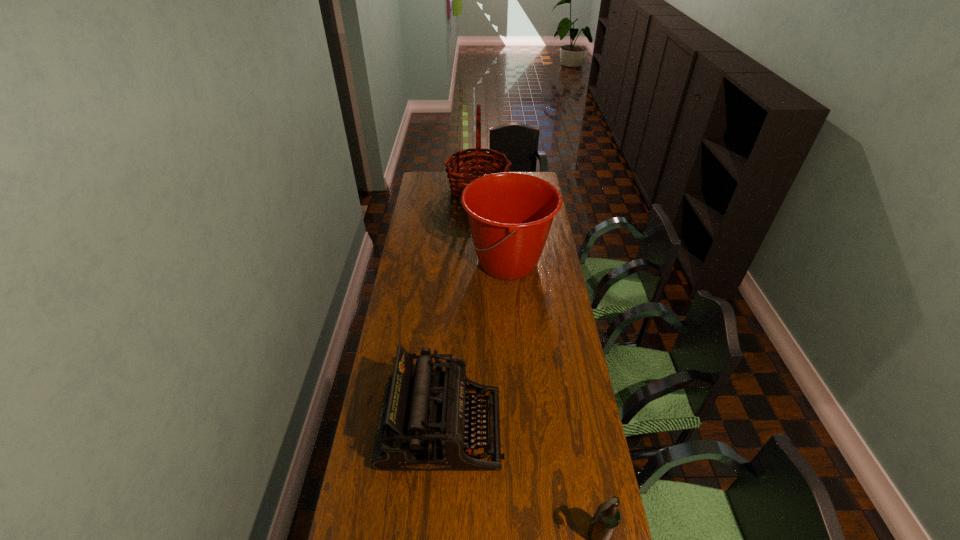
You are a GUI agent. You are given a task and a screenshot of the screen. Output one action in this format:
    pyautogui.click(x=<x>, y=<y>)
    Task: Click on the vacant region that satisfies the following two spatial constraints: 1. on the front side of the tallest object; 2. on the keyboard of the third farthest object
    
    Given the screenshot: What is the action you would take?
    pyautogui.click(x=476, y=428)